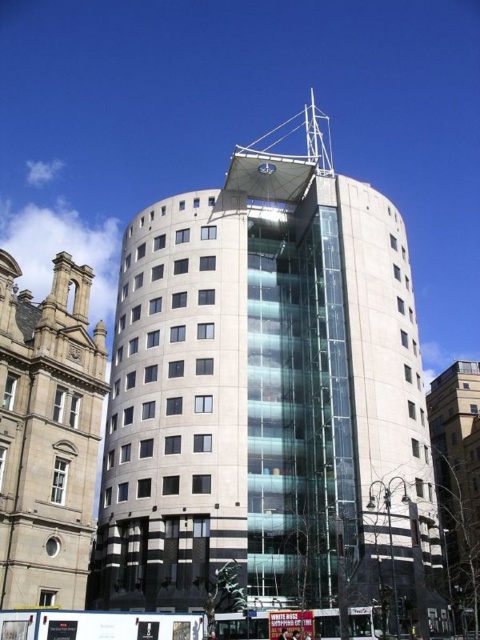
Between white glass building at center and stone building at left, which one appears on the right side from the viewer's perspective?

From the viewer's perspective, white glass building at center appears more on the right side.

Which of these two, white glass building at center or stone building at left, stands shorter?

stone building at left

Between point (151, 371) and point (84, 436), which one is positioned in front?

Point (84, 436)

The width and height of the screenshot is (480, 640). Identify the location of white glass building at center. (264, 392).